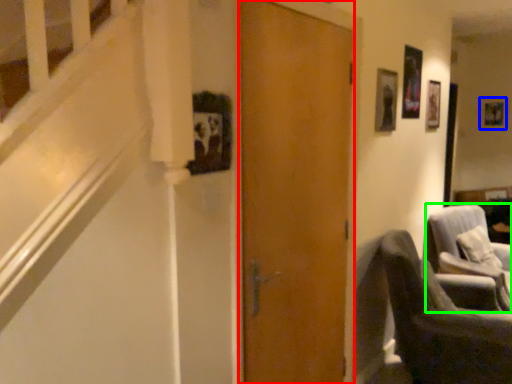
Question: Which object is positioned closest to door (highlighted by a red box)? Select from picture frame (highlighted by a blue box) and chair (highlighted by a green box).

Choices:
 (A) picture frame
 (B) chair

Answer: (B)